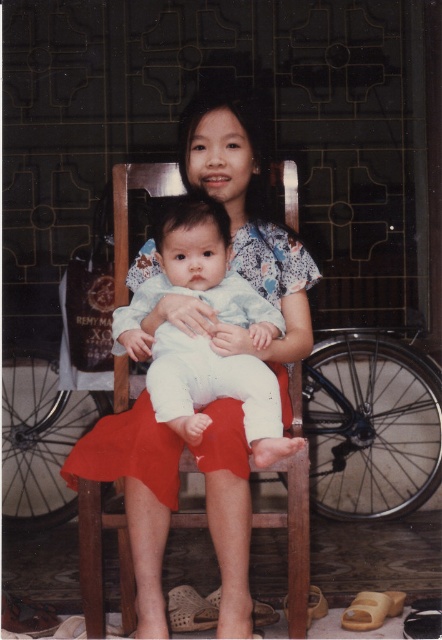
Question: Among these objects, which one is farthest from the camera?

Choices:
 (A) light blue fabric baby at center
 (B) matte floral dress at center

Answer: (B)

Question: Does matte floral dress at center have a smaller size compared to light blue fabric baby at center?

Choices:
 (A) yes
 (B) no

Answer: (B)

Question: Is matte floral dress at center wider than light blue fabric baby at center?

Choices:
 (A) yes
 (B) no

Answer: (A)

Question: Which object is closer to the camera taking this photo?

Choices:
 (A) matte floral dress at center
 (B) light blue fabric baby at center

Answer: (B)

Question: Does matte floral dress at center have a smaller size compared to light blue fabric baby at center?

Choices:
 (A) no
 (B) yes

Answer: (A)